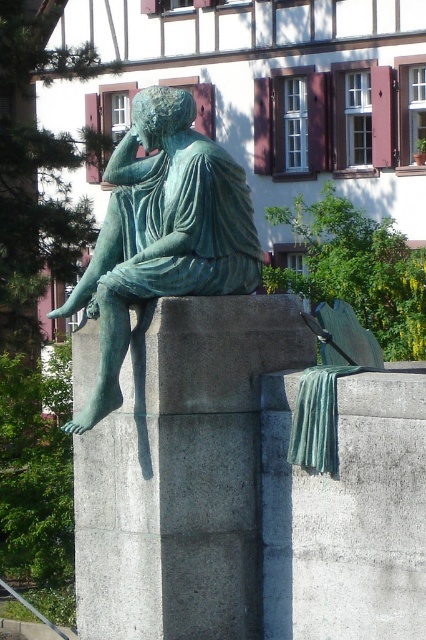
What do you see at coordinates (181, 472) in the screenshot? This screenshot has width=426, height=640. I see `green stone pillar at center` at bounding box center [181, 472].

Where is `green stone pillar at center`? The image size is (426, 640). green stone pillar at center is located at coordinates (181, 472).

Identify the location of green stone pillar at center. The width and height of the screenshot is (426, 640). [x=181, y=472].